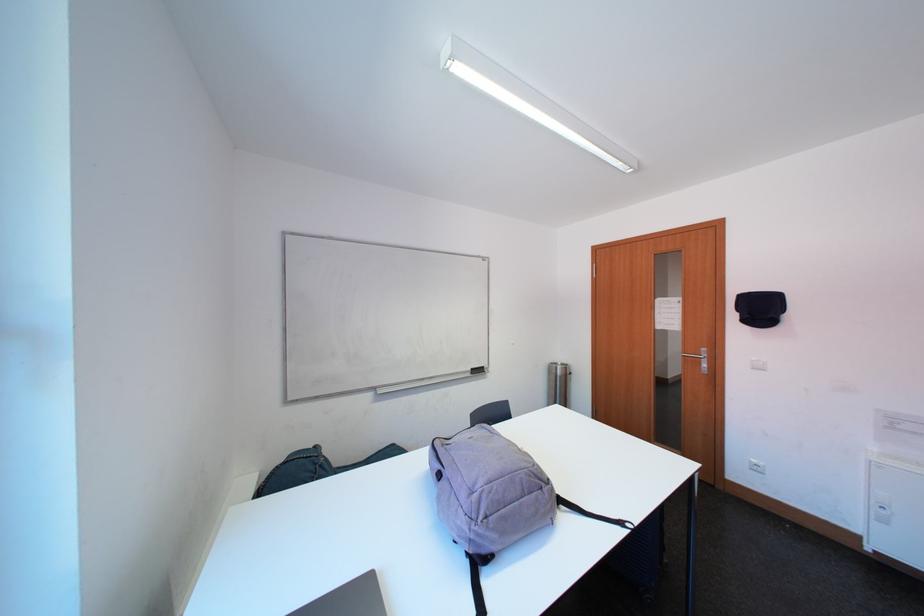
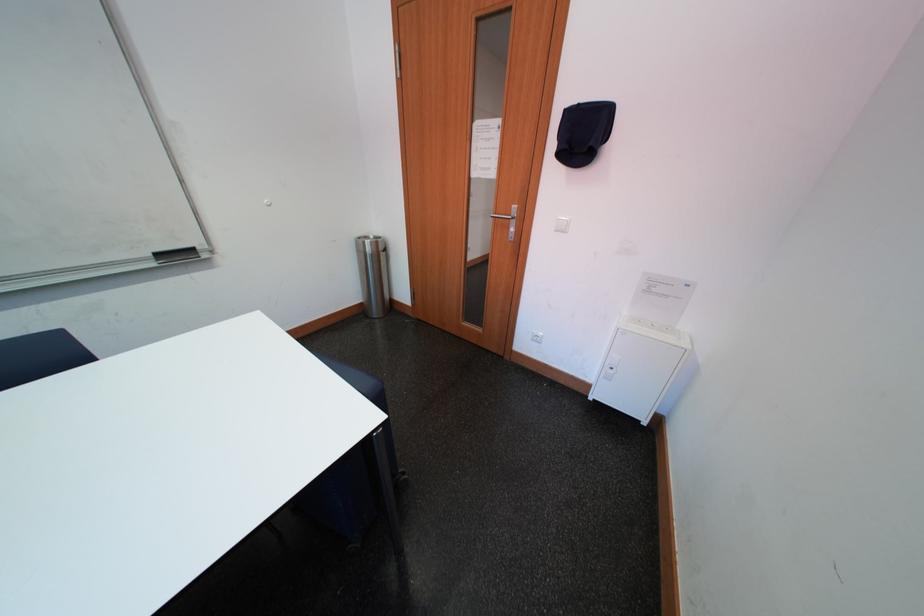
The point at [771,313] is marked in the first image. Where is the corresponding point in the second image?

(593, 140)